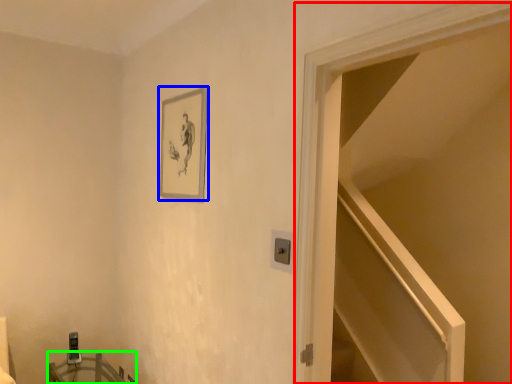
Question: Which is farther away from door (highlighted by a red box)? picture frame (highlighted by a blue box) or table (highlighted by a green box)?

Choices:
 (A) picture frame
 (B) table

Answer: (B)